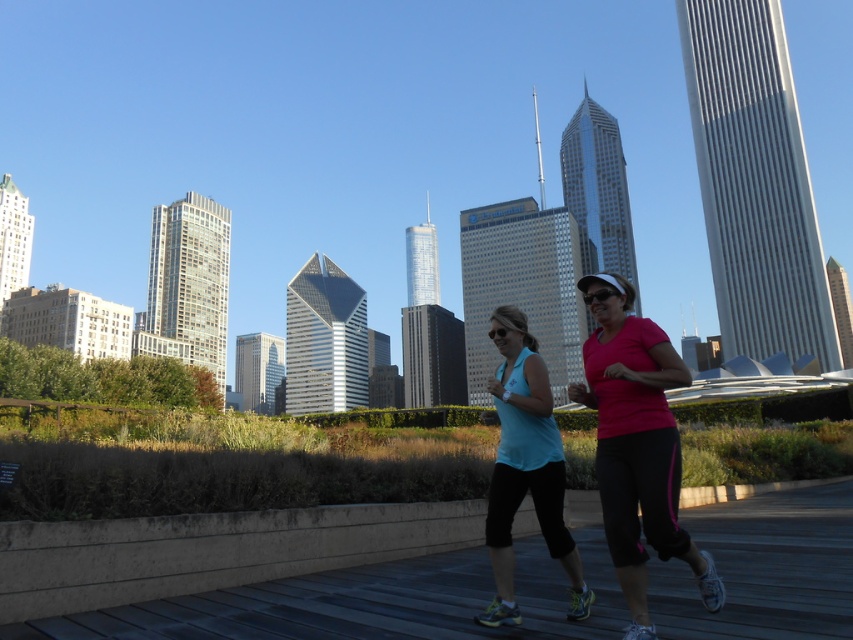
Question: Is matte pink shirt at center behind matte blue tank top at center?

Choices:
 (A) yes
 (B) no

Answer: (B)

Question: Is matte pink shirt at center above matte blue tank top at center?

Choices:
 (A) no
 (B) yes

Answer: (B)

Question: Considering the relative positions of matte pink shirt at center and matte blue tank top at center in the image provided, where is matte pink shirt at center located with respect to matte blue tank top at center?

Choices:
 (A) left
 (B) right

Answer: (B)